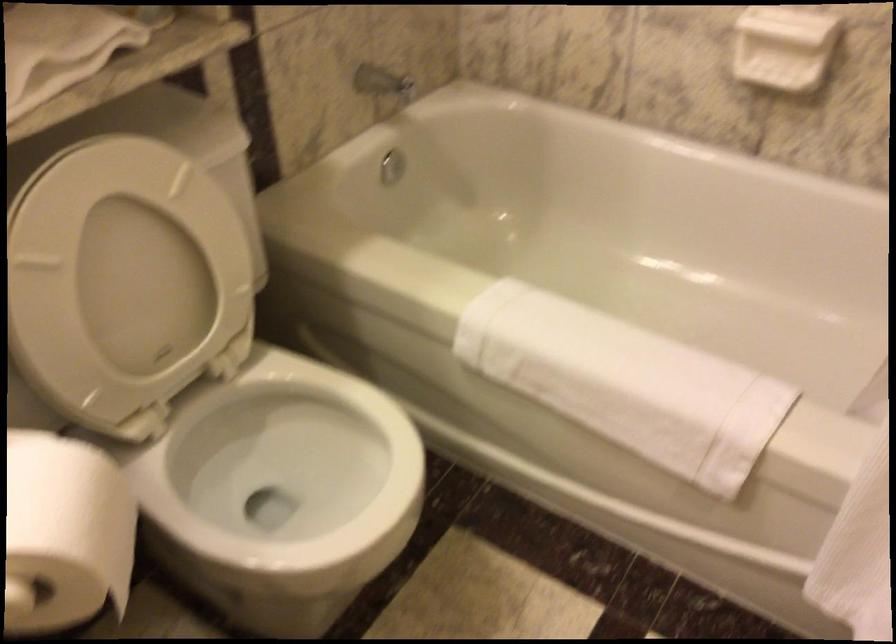
What do you see at coordinates (374, 80) in the screenshot? This screenshot has width=896, height=644. I see `the silver faucet handle` at bounding box center [374, 80].